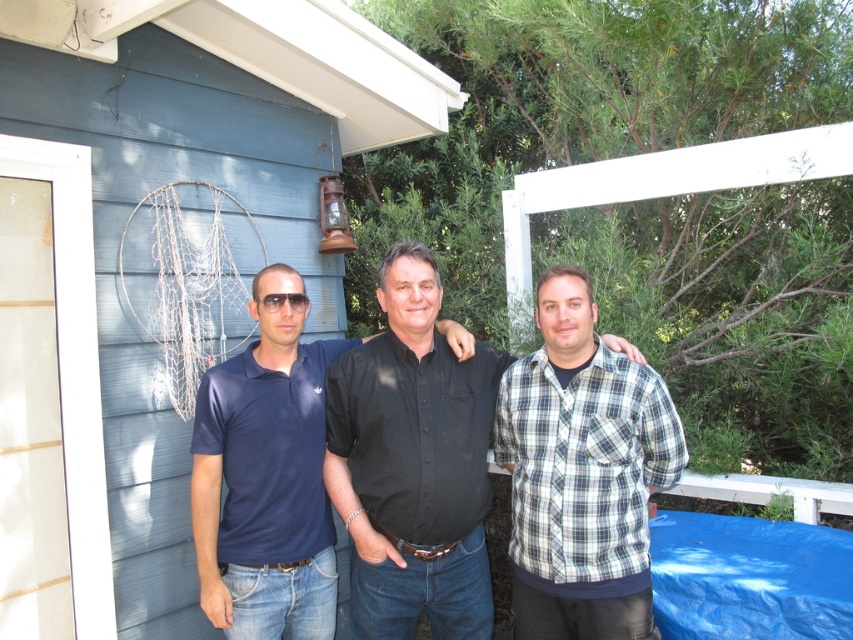
Question: Which point is closer to the camera taking this photo?

Choices:
 (A) (297, 294)
 (B) (384, 467)
 (C) (664, 416)

Answer: (C)

Question: In this image, where is black matte shirt at center located relative to dark blue cotton polo shirt at center?

Choices:
 (A) above
 (B) below

Answer: (A)

Question: In this image, where is black matte shirt at center located relative to dark blue cotton polo shirt at center?

Choices:
 (A) below
 (B) above

Answer: (B)

Question: Estimate the real-world distances between objects in this image. Which object is closer to the black matte shirt at center?

Choices:
 (A) dark blue cotton polo shirt at center
 (B) plaid cotton shirt at center

Answer: (A)

Question: Which point appears farthest from the camera in this image?

Choices:
 (A) (256, 390)
 (B) (450, 564)
 (C) (608, 516)

Answer: (A)

Question: Does black matte shirt at center appear on the left side of dark blue cotton polo shirt at center?

Choices:
 (A) no
 (B) yes

Answer: (A)